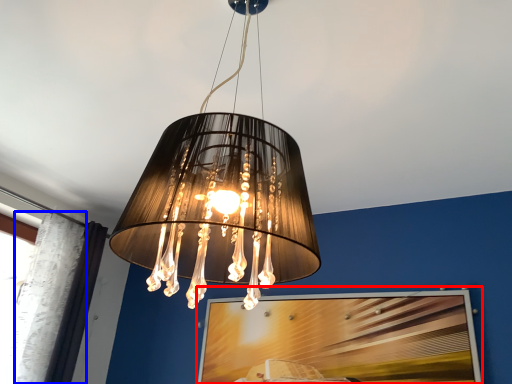
Question: Which of the following is the closest to the observer, picture frame (highlighted by a red box) or curtain (highlighted by a blue box)?

Choices:
 (A) picture frame
 (B) curtain

Answer: (A)